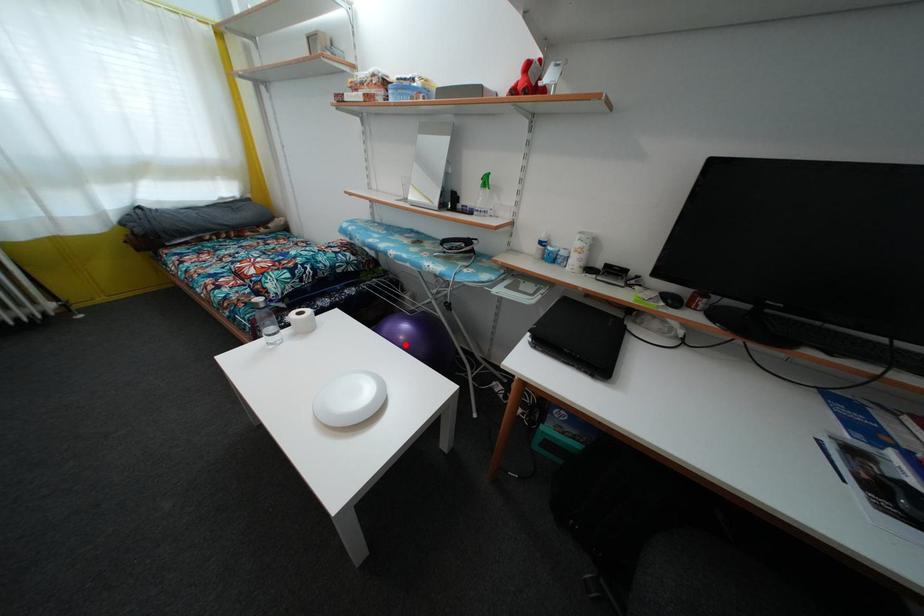
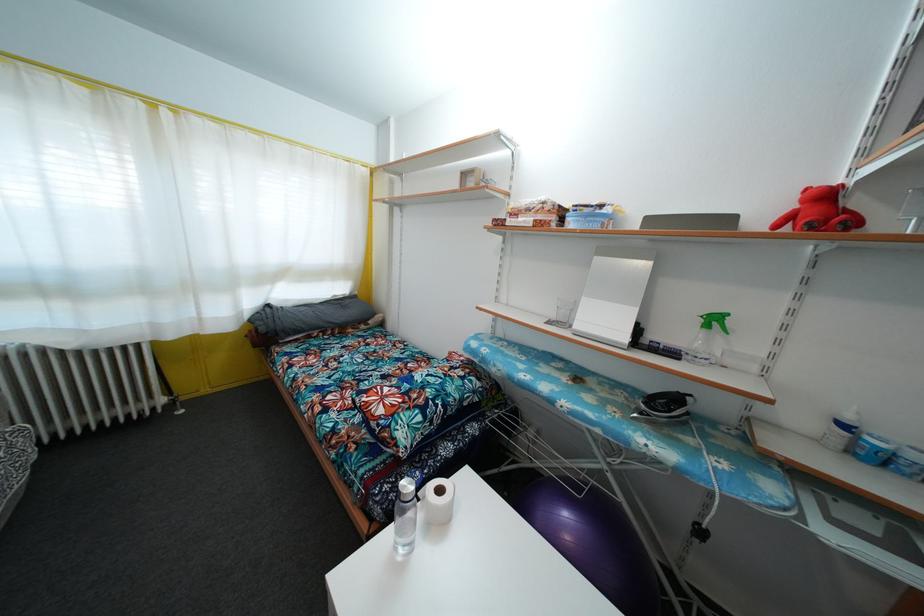
Question: I am providing you with two images of the same scene from different viewpoints. In image1, a red point is highlighted. Considering the same 3D point in image2, which of the following is correct?

Choices:
 (A) It is closer
 (B) It is farther

Answer: (A)